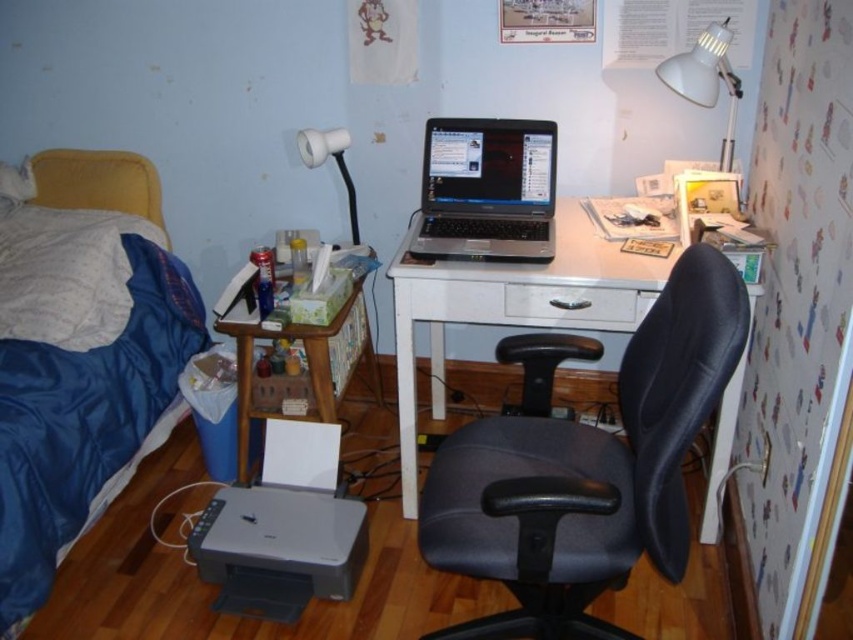
Question: Does black leather swivel chair at center appear on the right side of woodenobject at left?

Choices:
 (A) no
 (B) yes

Answer: (B)

Question: Can you confirm if woodenobject at left is positioned above white plastic lamp at upper center?

Choices:
 (A) yes
 (B) no

Answer: (B)

Question: Which object is positioned farthest from the white plastic lamp at upper center?

Choices:
 (A) gray matte printer at lower left
 (B) white matte desk lamp at upper right

Answer: (B)

Question: Is gray matte printer at lower left thinner than woodenobject at left?

Choices:
 (A) no
 (B) yes

Answer: (A)

Question: Based on their relative distances, which object is farther from the blue fabric bed at left?

Choices:
 (A) white plastic lamp at upper center
 (B) woodenobject at left

Answer: (A)

Question: Which object appears closest to the camera in this image?

Choices:
 (A) blue fabric bed at left
 (B) satin black laptop at center
 (C) white matte desk lamp at upper right

Answer: (A)